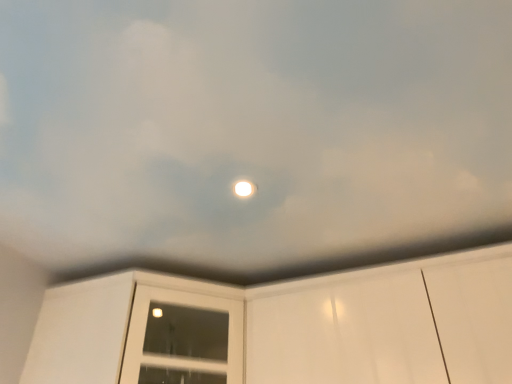
You are a GUI agent. You are given a task and a screenshot of the screen. Output one action in this format:
    pyautogui.click(x=<x>, y=<y>)
    Task: Click on the matte white ceiling at center
    
    Given the screenshot: What is the action you would take?
    pyautogui.click(x=252, y=133)

What is the approximate height of matte white ceiling at center?

matte white ceiling at center is 3.74 centimeters in height.

Describe the element at coordinates (252, 133) in the screenshot. I see `matte white ceiling at center` at that location.

Where is `matte white ceiling at center`? matte white ceiling at center is located at coordinates (252, 133).